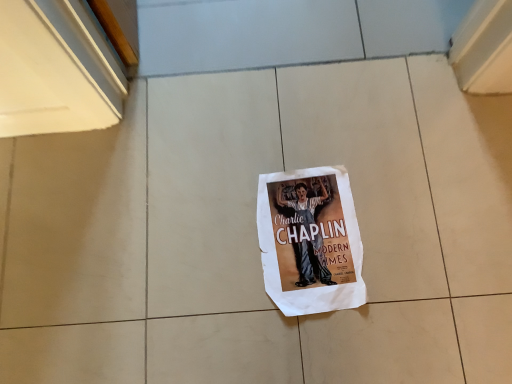
The image size is (512, 384). Describe the element at coordinates (310, 241) in the screenshot. I see `white paper poster at center` at that location.

In the scene shown: What is the approximate height of white paper poster at center?

0.59 inches.

Locate an element on the screen. The image size is (512, 384). white paper poster at center is located at coordinates (310, 241).

Where is `white paper poster at center`? This screenshot has width=512, height=384. white paper poster at center is located at coordinates (310, 241).